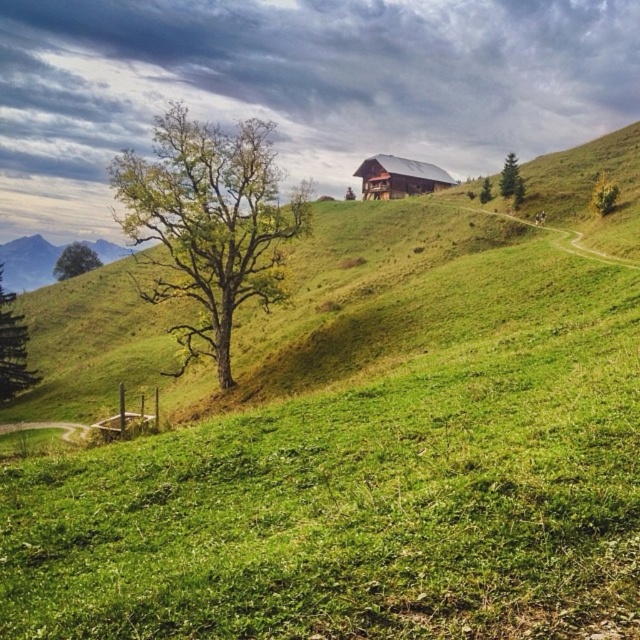
Question: Which point is closer to the camera taking this photo?

Choices:
 (A) (605, 195)
 (B) (259, 252)
 (C) (1, 278)

Answer: (B)

Question: Is green leafy tree at center in front of green textured pine tree at upper right?

Choices:
 (A) yes
 (B) no

Answer: (A)

Question: Can you confirm if green leafy tree at center is bigger than green leafy tree at upper right?

Choices:
 (A) yes
 (B) no

Answer: (A)

Question: Is brown wooden hut at center thinner than green textured tree at lower left?

Choices:
 (A) no
 (B) yes

Answer: (B)

Question: Considering the real-world distances, which object is farthest from the green matte tree at upper right?

Choices:
 (A) brown wooden hut at center
 (B) green textured tree at lower left
 (C) green matte tree at left
 (D) green leafy tree at center

Answer: (C)

Question: Among these points, which one is nearest to the camera?

Choices:
 (A) (513, 188)
 (B) (218, 332)

Answer: (B)